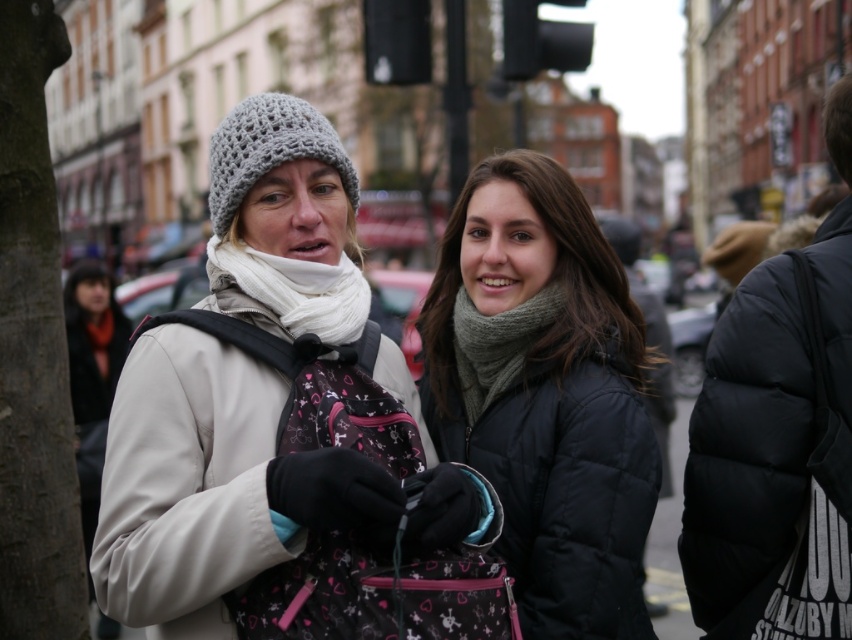
Question: Does black puffy coat at right come in front of knitted gray scarf at center?

Choices:
 (A) yes
 (B) no

Answer: (A)

Question: Does black puffy coat at right appear on the left side of knitted gray scarf at center?

Choices:
 (A) no
 (B) yes

Answer: (A)

Question: Which object is closer to the camera taking this photo?

Choices:
 (A) matte black jacket at center
 (B) knitted gray scarf at center
 (C) black puffy coat at right

Answer: (A)

Question: Which point appears farthest from the camera in this image?

Choices:
 (A) (545, 429)
 (B) (553, 308)

Answer: (B)

Question: Which point is closer to the camera?

Choices:
 (A) (772, 472)
 (B) (329, 310)

Answer: (A)

Question: Can you confirm if white matte jacket at center is positioned above black puffy coat at right?

Choices:
 (A) no
 (B) yes

Answer: (A)